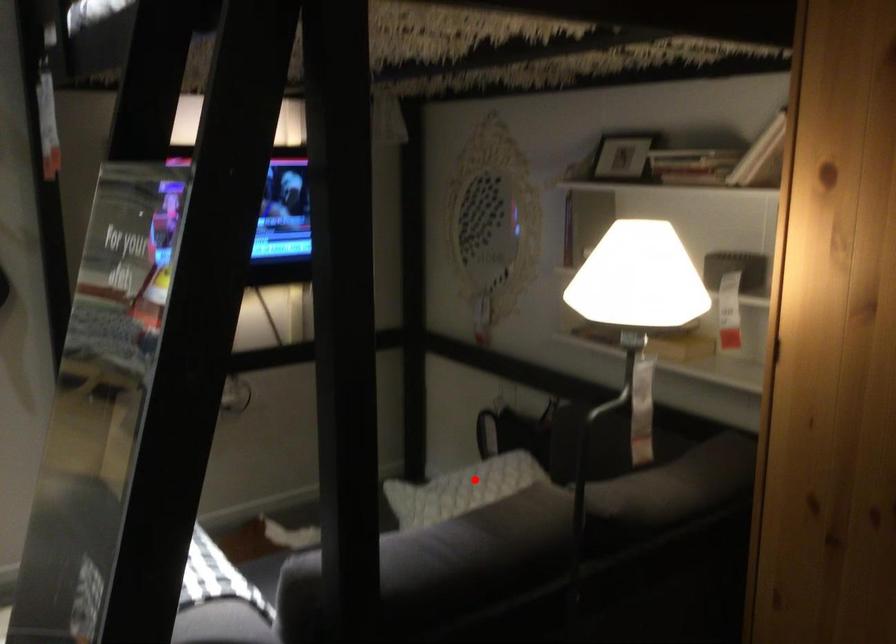
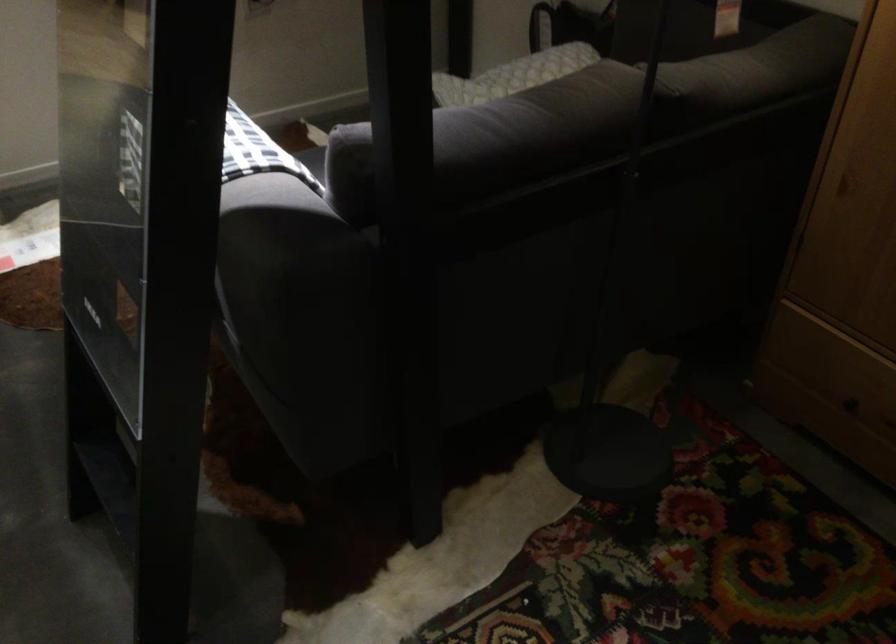
Where in the second image is the point corresponding to the highlighted location from the first image?

(528, 68)